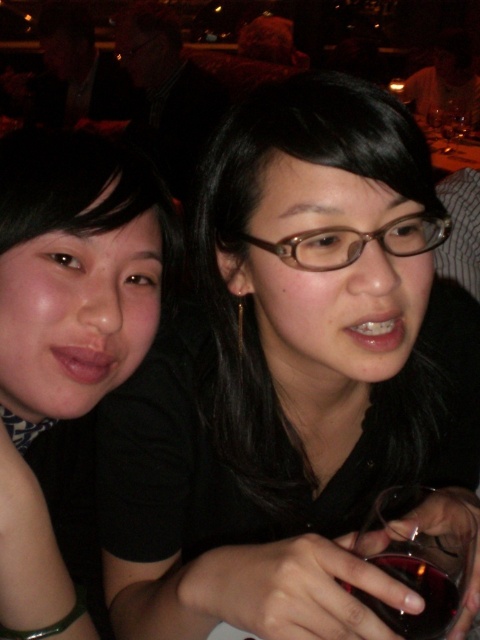
Question: Among these points, which one is farthest from the camera?

Choices:
 (A) (218, 330)
 (B) (439, 625)

Answer: (A)

Question: Is the position of black matte hair at center less distant than that of transparent glass at lower right?

Choices:
 (A) yes
 (B) no

Answer: (A)

Question: Which of these objects is positioned closest to the transparent glass at lower right?

Choices:
 (A) black matte hair at center
 (B) matte black hair at upper left

Answer: (A)

Question: Which of the following is the closest to the observer?

Choices:
 (A) black matte hair at center
 (B) transparent glass at lower right
 (C) matte black hair at upper left

Answer: (A)

Question: Considering the relative positions of black matte hair at center and matte black hair at upper left in the image provided, where is black matte hair at center located with respect to matte black hair at upper left?

Choices:
 (A) above
 (B) below

Answer: (B)

Question: Can you confirm if matte black hair at upper left is thinner than transparent glass at lower right?

Choices:
 (A) yes
 (B) no

Answer: (B)